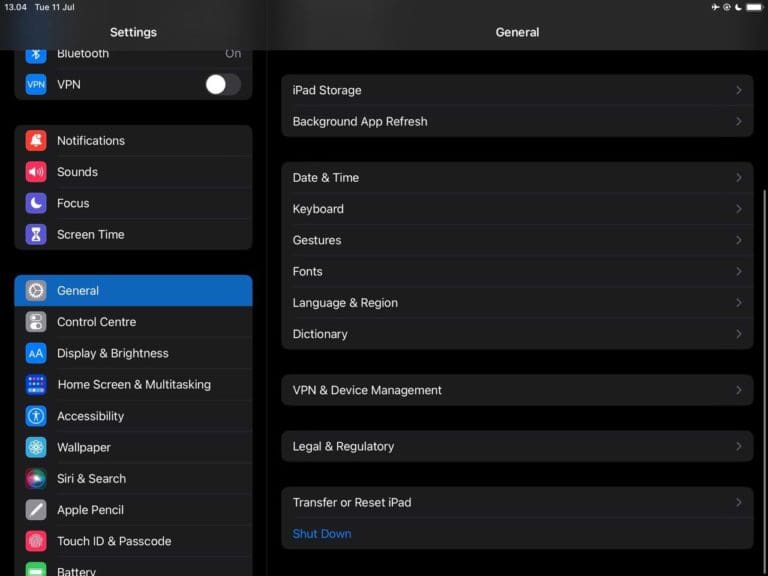
Locate an element on the screen. The height and width of the screenshot is (576, 768). accessibility button is located at coordinates (134, 415).